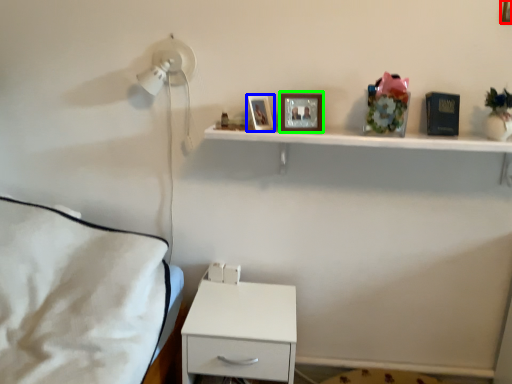
Question: Estimate the real-world distances between objects in this image. Which object is farther from picture frame (highlighted by a red box), picture frame (highlighted by a blue box) or picture frame (highlighted by a green box)?

Choices:
 (A) picture frame
 (B) picture frame

Answer: (A)